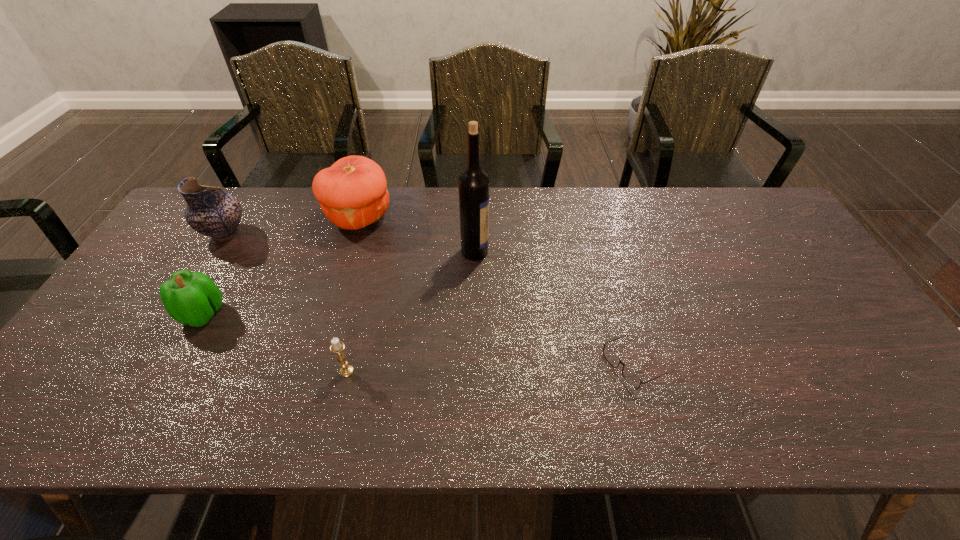
Locate an element on the screen. The height and width of the screenshot is (540, 960). free space at the far edge of the desktop is located at coordinates (608, 199).

The image size is (960, 540). I want to click on free space at the left edge, so click(132, 315).

The height and width of the screenshot is (540, 960). In order to click on vacant space at the right edge in this screenshot , I will do `click(804, 288)`.

I want to click on free region at the far right corner of the desktop, so click(x=756, y=206).

The width and height of the screenshot is (960, 540). I want to click on vacant space in between the fourth farthest object and the spectacles, so click(x=418, y=340).

At what (x,y) coordinates should I click in order to perform the action: click on free spot between the bell pepper and the pottery. Please return your answer as a coordinate pair (x, y). The image size is (960, 540). Looking at the image, I should click on (214, 274).

Locate an element on the screen. free spot between the shortest object and the pumpkin is located at coordinates (495, 291).

This screenshot has width=960, height=540. Find the location of `blank region between the shortest object and the tallest object`. blank region between the shortest object and the tallest object is located at coordinates (553, 308).

You are a GUI agent. You are given a task and a screenshot of the screen. Output one action in this format:
    pyautogui.click(x=<x>, y=<y>)
    Task: Click on the free space that is in between the candle holder and the bell pepper
    
    Given the screenshot: What is the action you would take?
    tap(275, 342)

At what (x,y) coordinates should I click in order to perform the action: click on free spot between the pottery and the candle holder. Please return your answer as a coordinate pair (x, y). Image resolution: width=960 pixels, height=540 pixels. Looking at the image, I should click on (286, 302).